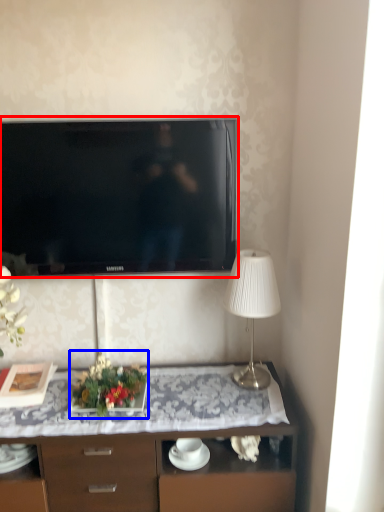
Question: Which point is further to the camera, television (highlighted by a red box) or floral arrangement (highlighted by a blue box)?

Choices:
 (A) television
 (B) floral arrangement

Answer: (A)